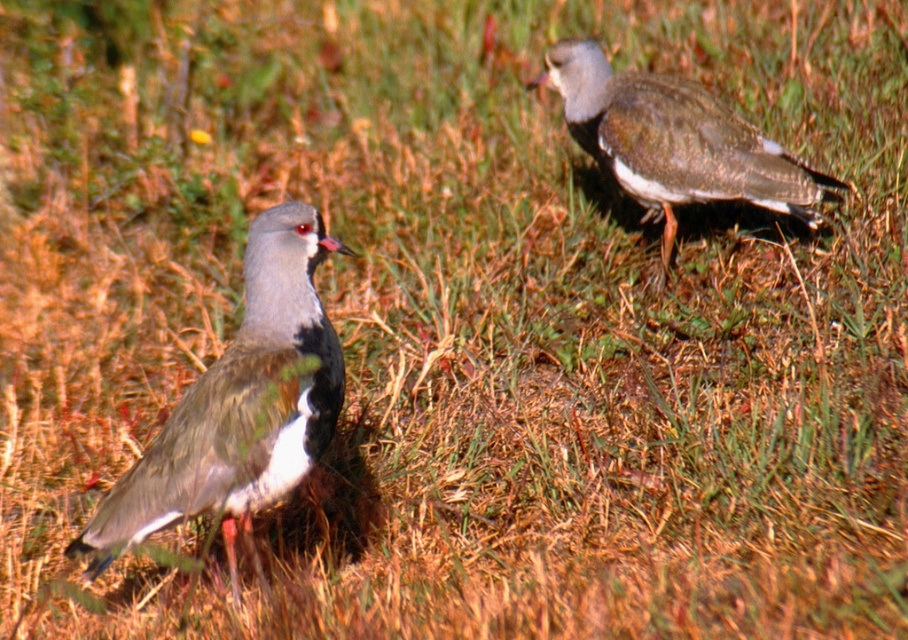
You are a birdwatcher observing the two birds in the scene. You notice both have brown speckled feathers at left and brown speckled feathers at upper right. Which set of feathers is located higher up in the image?

The brown speckled feathers at upper right are located higher up in the image than the brown speckled feathers at left.

You are standing at the origin point of the coordinate system. You see two points, point (x=312, y=259) and point (x=762, y=176). Which point is closer to you?

Point (x=312, y=259) is in front of point (x=762, y=176), so it is closer to you.